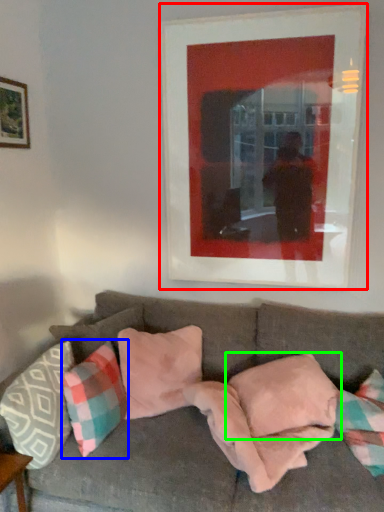
Question: Based on their relative distances, which object is nearer to picture frame (highlighted by a red box)? Choose from pillow (highlighted by a blue box) and pillow (highlighted by a green box).

Choices:
 (A) pillow
 (B) pillow

Answer: (B)